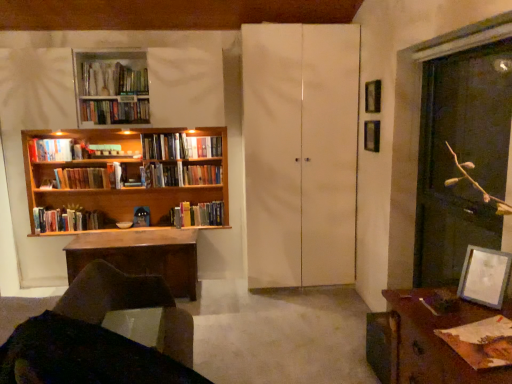
Question: Is brown wooden desk at lower right further to camera compared to wooden bookcase at left?

Choices:
 (A) yes
 (B) no

Answer: (B)

Question: Is brown wooden desk at lower right closer to camera compared to wooden bookcase at left?

Choices:
 (A) no
 (B) yes

Answer: (B)

Question: Is brown wooden desk at lower right turned away from wooden bookcase at left?

Choices:
 (A) yes
 (B) no

Answer: (B)

Question: Is brown wooden desk at lower right smaller than wooden bookcase at left?

Choices:
 (A) no
 (B) yes

Answer: (B)

Question: Is brown wooden desk at lower right outside of wooden bookcase at left?

Choices:
 (A) yes
 (B) no

Answer: (A)

Question: Is hardcover book at upper left, arranged as the 4th book when viewed from the front, taller or shorter than wooden bookshelf at center, the ninth book positioned from the front?

Choices:
 (A) short
 (B) tall

Answer: (A)

Question: Looking at their shapes, would you say hardcover book at upper left, arranged as the 6th book when viewed from the back, is wider or thinner than wooden bookshelf at center, which is counted as the 1th book, starting from the back?

Choices:
 (A) wide
 (B) thin

Answer: (A)

Question: From a real-world perspective, is hardcover book at upper left, arranged as the 6th book when viewed from the back, physically located above or below wooden bookshelf at center, which is counted as the 1th book, starting from the back?

Choices:
 (A) above
 (B) below

Answer: (A)

Question: Would you say hardcover book at upper left, arranged as the 6th book when viewed from the back, is to the left or to the right of wooden bookshelf at center, which is counted as the 1th book, starting from the back, in the picture?

Choices:
 (A) right
 (B) left

Answer: (B)

Question: Based on their sizes in the image, would you say brown leather chair at lower left is bigger or smaller than matte brown book at lower right, the first book in the front-to-back sequence?

Choices:
 (A) small
 (B) big

Answer: (B)

Question: Is brown leather chair at lower left taller or shorter than matte brown book at lower right, the 9th book positioned from the back?

Choices:
 (A) short
 (B) tall

Answer: (B)

Question: From the image's perspective, is brown leather chair at lower left located above or below matte brown book at lower right, the 9th book positioned from the back?

Choices:
 (A) above
 (B) below

Answer: (B)

Question: Is point (101, 278) closer or farther from the camera than point (486, 345)?

Choices:
 (A) closer
 (B) farther

Answer: (B)

Question: Considering the positions of transparent glass screen door at right, placed as the first screen door when sorted from front to back, and metallic silver picture frame at upper right, marked as the 2th picture frame in a top-to-bottom arrangement, in the image, is transparent glass screen door at right, placed as the first screen door when sorted from front to back, wider or thinner than metallic silver picture frame at upper right, marked as the 2th picture frame in a top-to-bottom arrangement,?

Choices:
 (A) thin
 (B) wide

Answer: (B)

Question: Is transparent glass screen door at right, marked as the second screen door in a back-to-front arrangement, bigger or smaller than metallic silver picture frame at upper right, which ranks as the 3th picture frame in front-to-back order?

Choices:
 (A) small
 (B) big

Answer: (B)